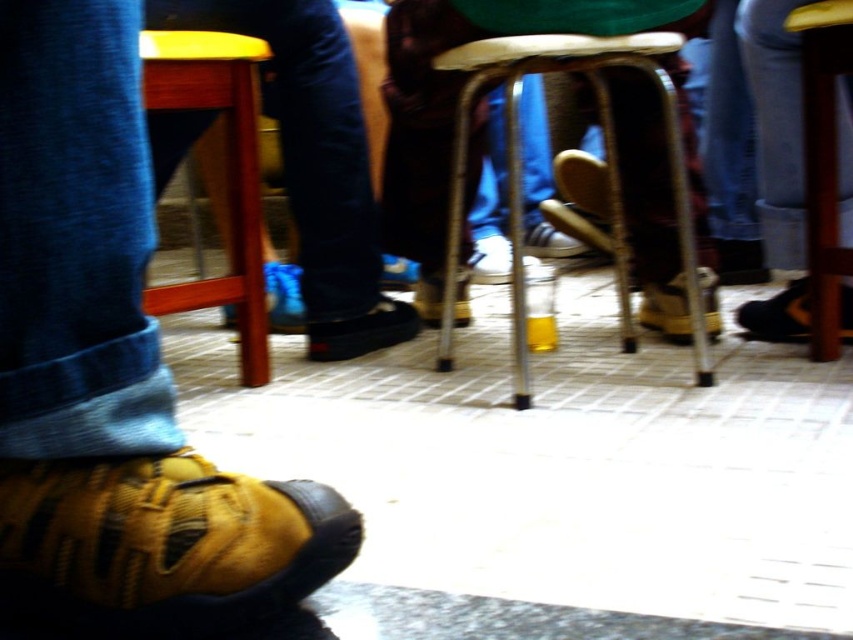
You are a customer in a cafe and want to place a small tray between the yellow fabric shoe at lower left and the black leather shoe at lower right. Can the tray fit between them if the tray is 10 cm wide?

The yellow fabric shoe at lower left is wider than the black leather shoe at lower right, but the exact width difference isn

You are standing at the origin of the coordinate system in this image. You want to walk to the point labeled point (x=786, y=308). However, there is an obstacle at point (x=318, y=356). Will you be able to reach your destination without going around the obstacle?

Since point (x=318, y=356) is behind point (x=786, y=308), you can walk straight to point (x=786, y=308) without encountering the obstacle at point (x=318, y=356).

You are standing in the middle of the room and want to reach the two points marked in the image. Which point, point (97, 467) or point (780, 304), will you reach first as you move forward?

Point (97, 467) is closer to the viewer than point (780, 304), so you will reach point (97, 467) first.